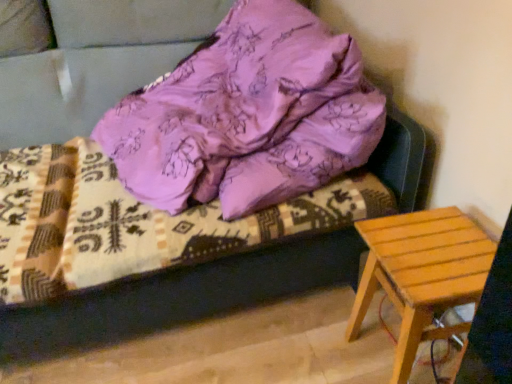
Where is `free point below light brown wooden stool at lower right (from a real-world perspective)`? This screenshot has width=512, height=384. free point below light brown wooden stool at lower right (from a real-world perspective) is located at coordinates (418, 351).